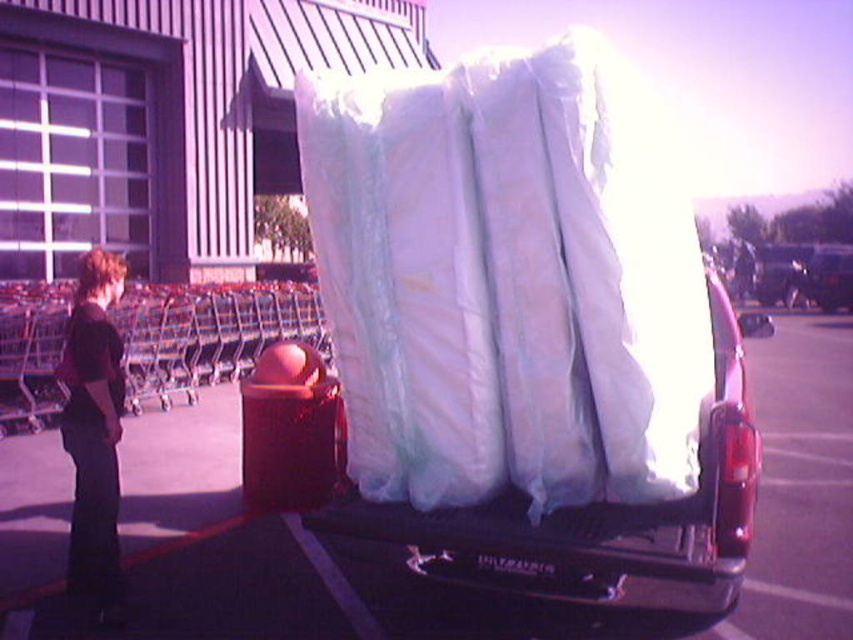
Question: Is translucent plastic mattress at center closer to the viewer compared to dark brown hair at left?

Choices:
 (A) no
 (B) yes

Answer: (B)

Question: Does translucent plastic mattress at center have a larger size compared to dark brown hair at left?

Choices:
 (A) no
 (B) yes

Answer: (B)

Question: Which point is closer to the camera?

Choices:
 (A) dark brown hair at left
 (B) translucent plastic mattress at center

Answer: (B)

Question: Does translucent plastic mattress at center have a smaller size compared to dark brown hair at left?

Choices:
 (A) yes
 (B) no

Answer: (B)

Question: Which object appears closest to the camera in this image?

Choices:
 (A) dark brown hair at left
 (B) translucent plastic mattress at center

Answer: (B)